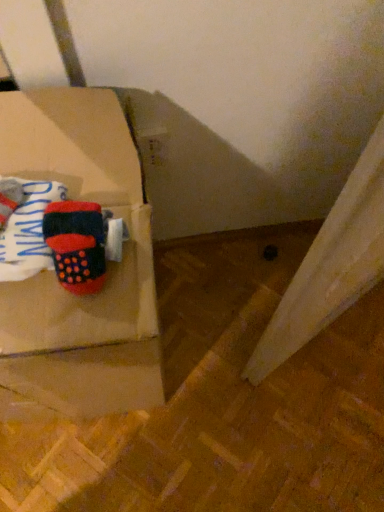
Find the location of a particular element. unoccupied area behind knitted wool socks at left is located at coordinates (55, 141).